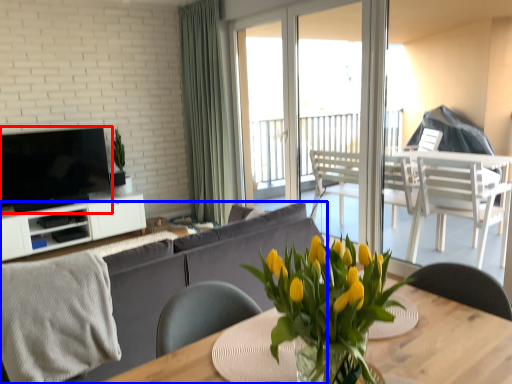
Question: Which object appears farthest to the camera in this image, television (highlighted by a red box) or studio couch (highlighted by a blue box)?

Choices:
 (A) television
 (B) studio couch

Answer: (A)